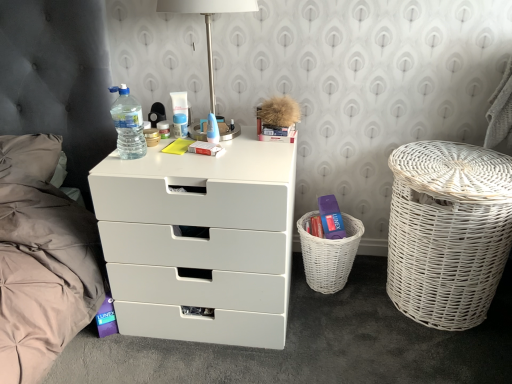
Image resolution: width=512 pixels, height=384 pixels. In order to click on vacant space behind translucent plastic cream at center, which is counted as the second toiletry, starting from the right in this screenshot , I will do `click(183, 118)`.